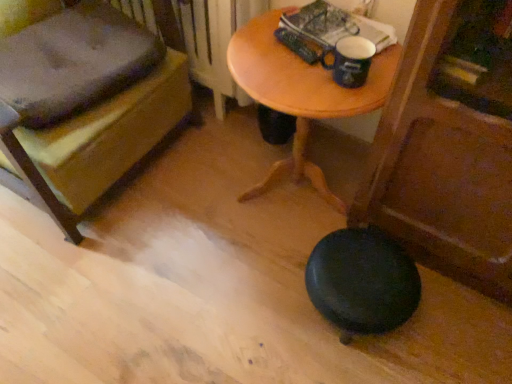
This screenshot has height=384, width=512. I want to click on free location above black rubber stool at lower right (from a real-world perspective), so click(x=364, y=271).